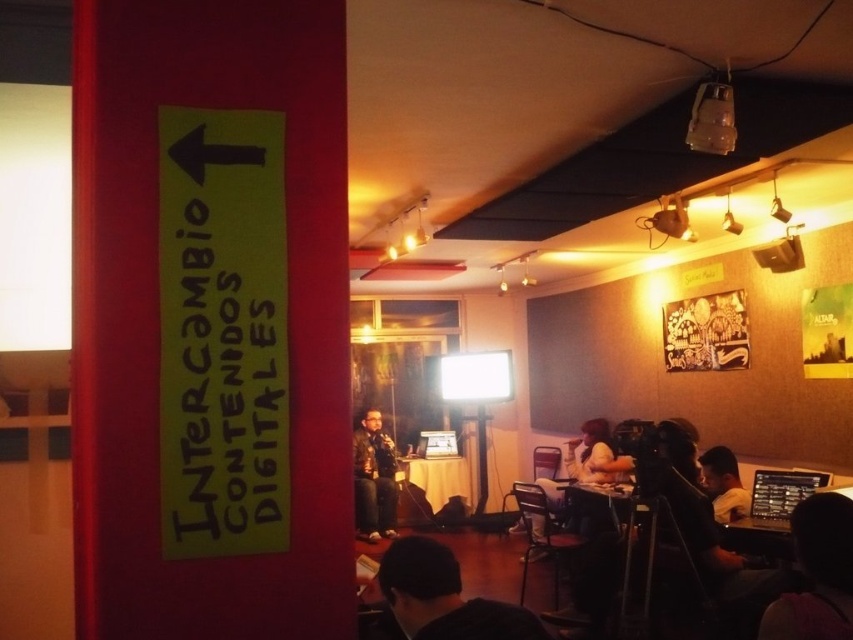
Question: Which point is closer to the camera?

Choices:
 (A) silhouette of person at lower right
 (B) black leather jacket at lower center
 (C) light brown leather jacket at lower right
 (D) matte black laptop at center

Answer: (B)

Question: Which is nearer to the matte black laptop at center?

Choices:
 (A) black leather jacket at lower center
 (B) light brown leather jacket at lower right

Answer: (B)

Question: Is silhouette of person at lower right further to camera compared to light brown leather jacket at lower right?

Choices:
 (A) no
 (B) yes

Answer: (A)

Question: Is silhouette of person at lower right in front of leather jacket at center?

Choices:
 (A) yes
 (B) no

Answer: (A)

Question: Is silhouette of person at lower right above leather jacket at center?

Choices:
 (A) yes
 (B) no

Answer: (A)

Question: Which of the following is the closest to the observer?

Choices:
 (A) (376, 449)
 (B) (631, 458)
 (C) (715, 452)
 (D) (502, 612)

Answer: (D)